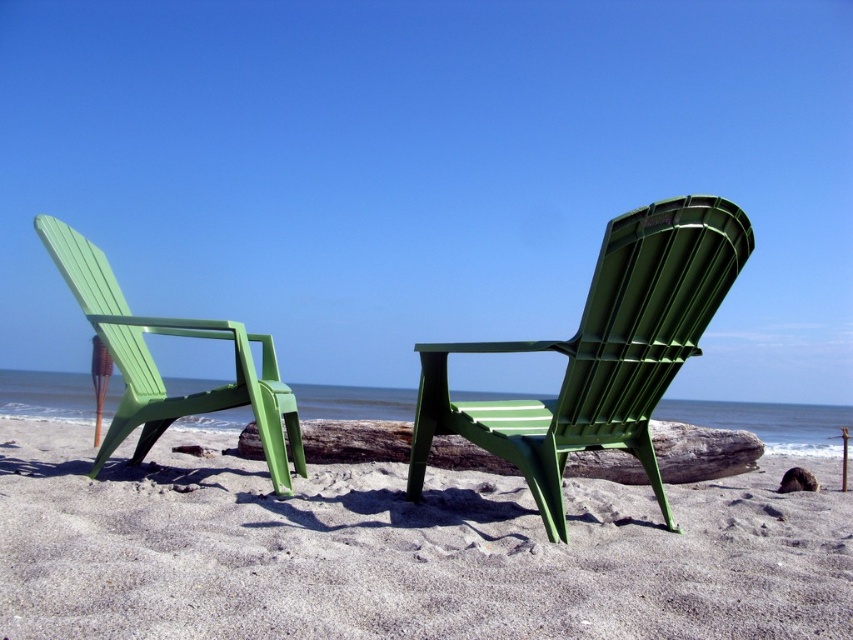
You are standing at the beach and want to reach a seashell located at point (537, 464). The seashell is 8.28 feet away from you. If you take 3 steps each of 2 feet, will you reach the seashell?

The point (537, 464) is 8.28 feet away from you. Taking 3 steps of 2 feet each covers 6 feet, so you won

You are standing at the camera position and want to place a 2.5 meter long wooden board between you and the green plastic beach chair at center. Is there enough space to place it without it touching the chair?

The distance between you and the green plastic beach chair at center is 2.30 meters. Since the board is 2.5 meters long, it would extend beyond the chair by 0.20 meters, so placing it would cause the board to touch or go past the chair. Therefore, there isn not enough space.